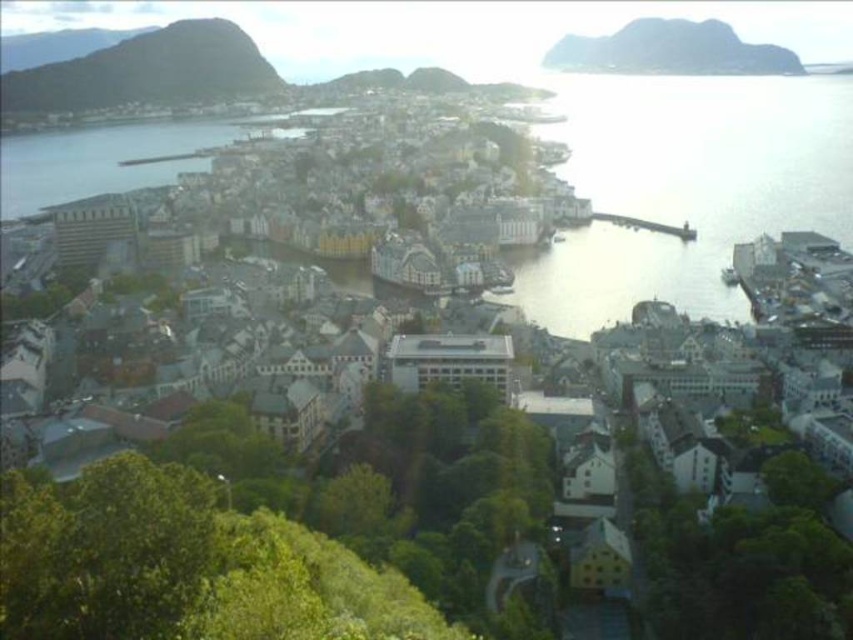
You are a hiker standing at the point with coordinates point (148,70). What is the terrain like at your current location?

The terrain at point (148,70) is rugged brown rock.

You are a hiker planning to cross from the rugged brown rock at upper left to the rocky gray cliff at upper right. Based on the scene, which path would be more challenging due to the terrain?

The rugged brown rock at upper left might be wider than the rocky gray cliff at upper right, so the path to the rocky gray cliff at upper right could be more challenging due to narrower terrain.